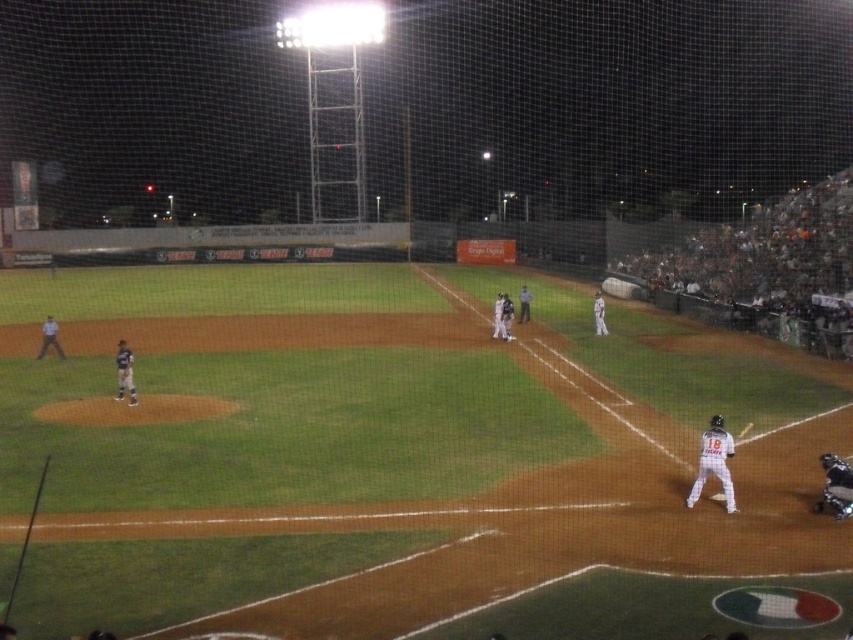
You are a spectator at the baseball game and want to take a photo of the batter. The white matte uniform at lower right and the metallic silver helmet at lower right are both in your camera frame. Which object should you focus on if you want to capture the one that is higher in the image?

The white matte uniform at lower right is above the metallic silver helmet at lower right, so you should focus on the white matte uniform at lower right to capture the higher object.

You are a photographer at the baseball game and want to capture a closeup of the metallic silver helmet at lower right. However, the white matte uniform at lower right is blocking the view. Can you still take a photo of the helmet without moving the uniform?

The white matte uniform at lower right is wider than the metallic silver helmet at lower right, so it might block the view. However, since they are both at the lower right, you might still be able to angle the camera to capture the metallic silver helmet at lower right partially if there is enough space between them.

You are a drone operator tasked with capturing aerial footage of the nighttime baseball game. Your drone must stay at least 25 meters away from any players to avoid interference. Based on the scene, is the white matte baseball player at upper right within the safe distance for your drone?

The white matte baseball player at upper right is only 23.89 meters away from the viewer, which is less than the required 25 meters. Therefore, the drone would be too close and should maintain a greater distance to comply with safety guidelines.